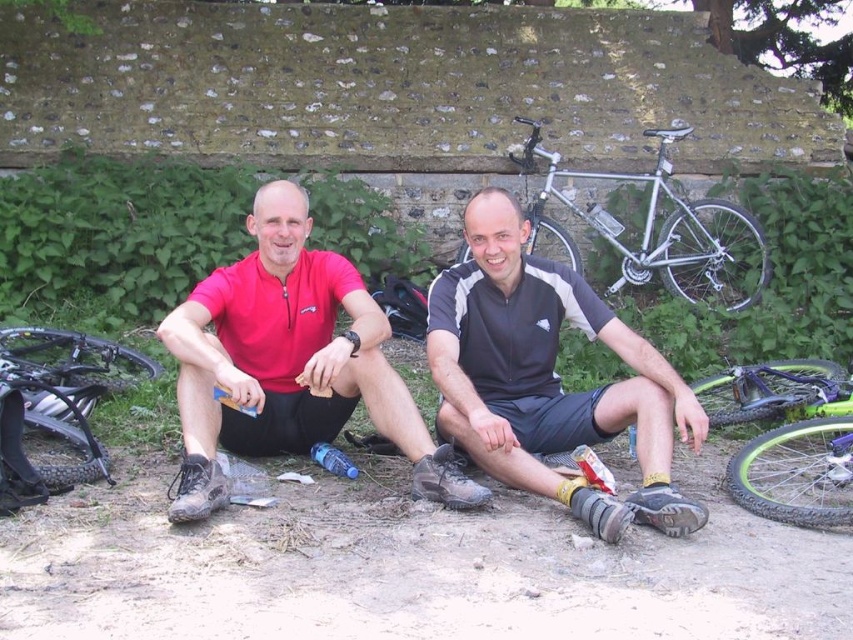
Looking at this image, you are planning to park your bicycle in this area. You have a silver metallic bicycle at upper right and a brushed metal mountain bike at left. Which bicycle is located to the right of the other?

The silver metallic bicycle at upper right is positioned on the right side of the brushed metal mountain bike at left.

You are a cyclist who wants to park your bicycle close to the other bikes in the image. The green rubber bicycle at lower right and the brushed metal mountain bike at left are already parked. If your new bicycle is 2 meters long, can you park it between them without overlapping?

The distance between the green rubber bicycle at lower right and the brushed metal mountain bike at left is 4.22 meters. Since your bicycle is 2 meters long, there is enough space between them to park it without overlapping.